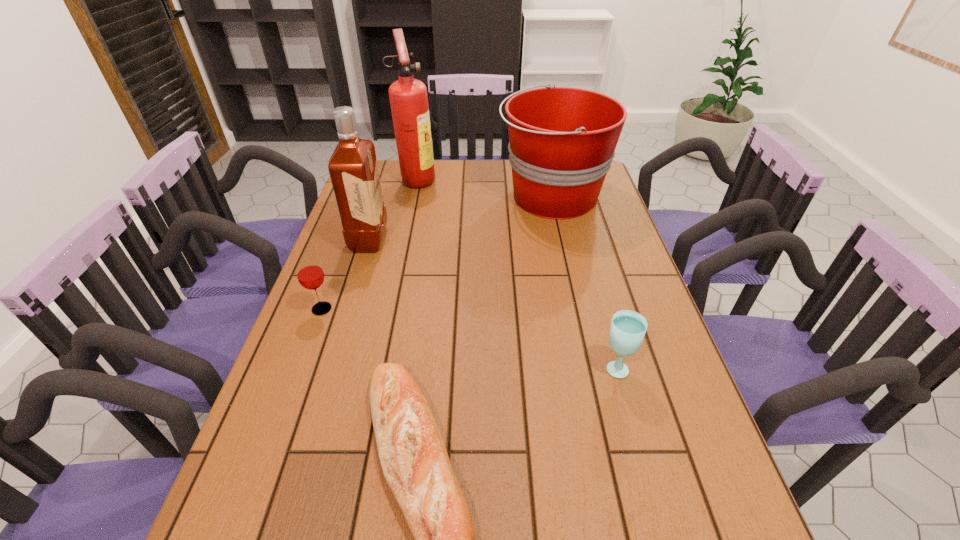
Identify the location of free space that satisfies the following two spatial constraints: 1. on the front-facing side of the fire extinguisher; 2. on the left side of the right glass. (379, 367).

Where is `blank area in the image that satisfies the following two spatial constraints: 1. on the front-facing side of the fourth shortest object; 2. on the right side of the tallest object`? This screenshot has width=960, height=540. blank area in the image that satisfies the following two spatial constraints: 1. on the front-facing side of the fourth shortest object; 2. on the right side of the tallest object is located at coordinates (414, 197).

Where is `vacant area in the image that satisfies the following two spatial constraints: 1. on the front label of the liquor; 2. on the front side of the farther glass`? vacant area in the image that satisfies the following two spatial constraints: 1. on the front label of the liquor; 2. on the front side of the farther glass is located at coordinates (348, 309).

The height and width of the screenshot is (540, 960). I want to click on free spot that satisfies the following two spatial constraints: 1. on the front side of the bucket; 2. on the front label of the second tallest object, so click(562, 240).

Where is `free point that satisfies the following two spatial constraints: 1. on the front label of the fifth shortest object; 2. on the left side of the nearer glass`? This screenshot has height=540, width=960. free point that satisfies the following two spatial constraints: 1. on the front label of the fifth shortest object; 2. on the left side of the nearer glass is located at coordinates (330, 367).

I want to click on free spot that satisfies the following two spatial constraints: 1. on the back side of the right glass; 2. on the front-facing side of the fire extinguisher, so click(x=564, y=179).